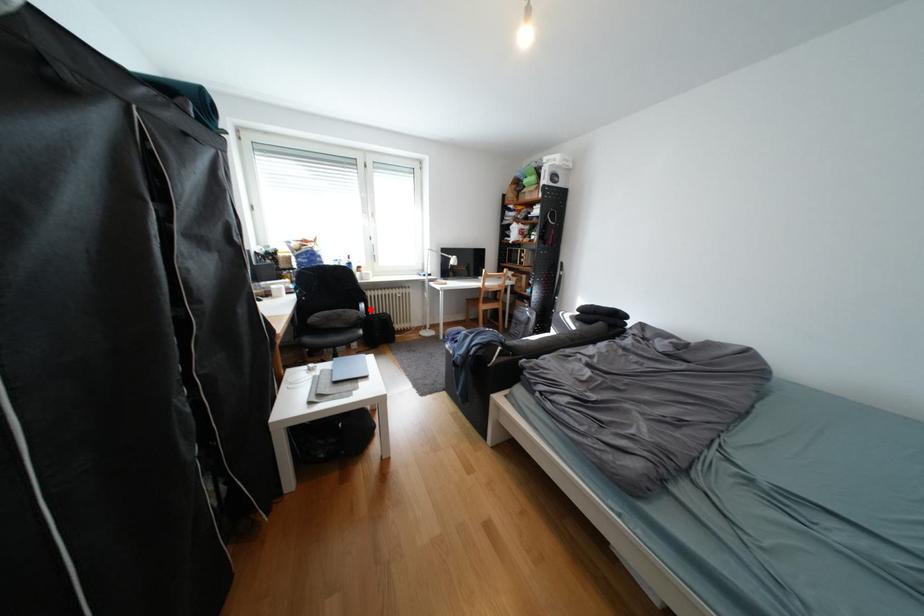
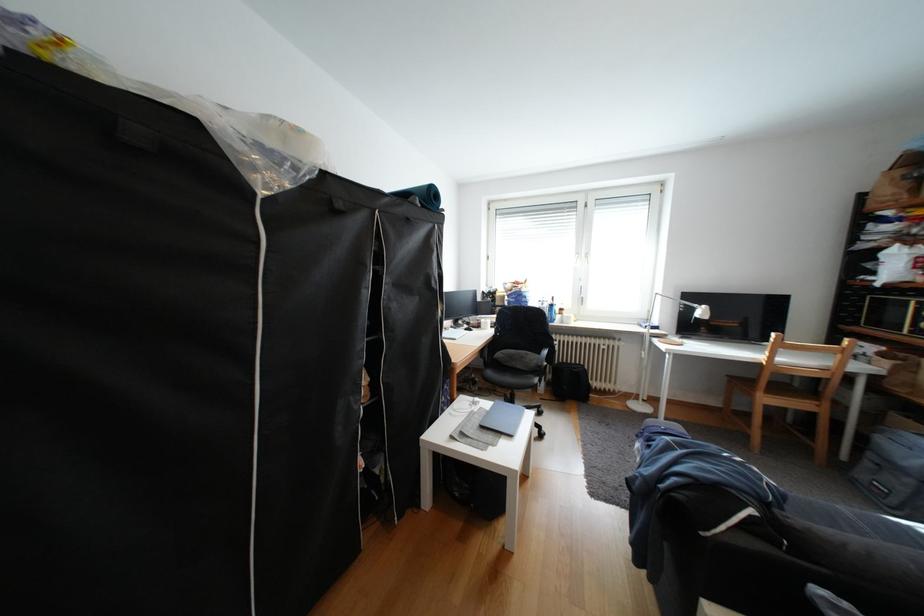
Question: I am providing you with two images of the same scene from different viewpoints. A red point is marked on the first image. Is the red point's position out of view in image 2?

Choices:
 (A) Yes
 (B) No

Answer: (B)